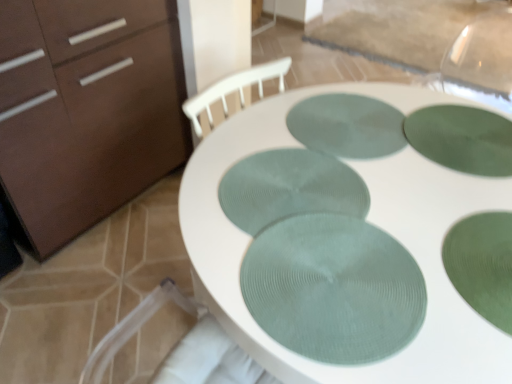
The height and width of the screenshot is (384, 512). In order to click on vacant area that is situated to the right of green textured placemat at center, which is the fifth glass plate in front-to-back order in this screenshot , I will do `click(449, 133)`.